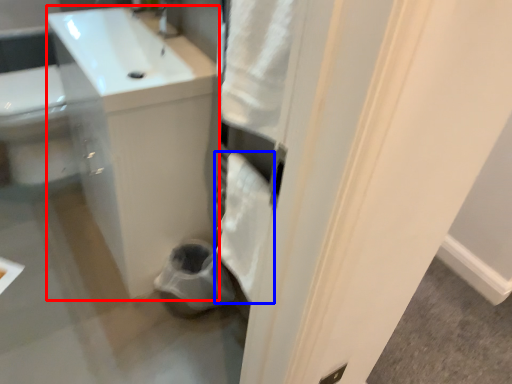
Question: Which point is further to the camera, counter top (highlighted by a red box) or bath towel (highlighted by a blue box)?

Choices:
 (A) counter top
 (B) bath towel

Answer: (A)